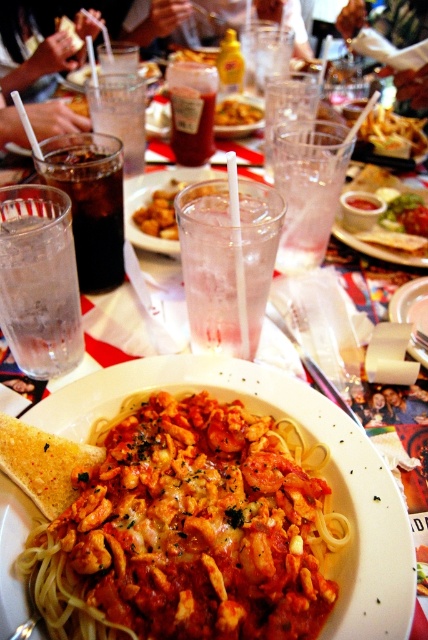
Question: Is clear glass at center smaller than translucent glass at center?

Choices:
 (A) no
 (B) yes

Answer: (A)

Question: Can you confirm if clear glass at center is positioned above golden crispy fries at upper right?

Choices:
 (A) no
 (B) yes

Answer: (A)

Question: Which object appears farthest from the camera in this image?

Choices:
 (A) shiny tomato sauce at center
 (B) clear glass at center
 (C) translucent glass at center
 (D) dark brown carbonated drink at left

Answer: (A)

Question: Can you confirm if shiny tomato sauce pasta at center is positioned to the right of clear glass at center?

Choices:
 (A) no
 (B) yes

Answer: (A)

Question: Considering the real-world distances, which object is farthest from the dark brown leather jacket at upper center?

Choices:
 (A) golden crispy fries at upper right
 (B) shiny tomato sauce pasta at center

Answer: (B)

Question: Which point is closer to the camera taking this photo?

Choices:
 (A) (217, 218)
 (B) (425, 12)
 (C) (217, 124)
 (D) (416, 122)

Answer: (A)